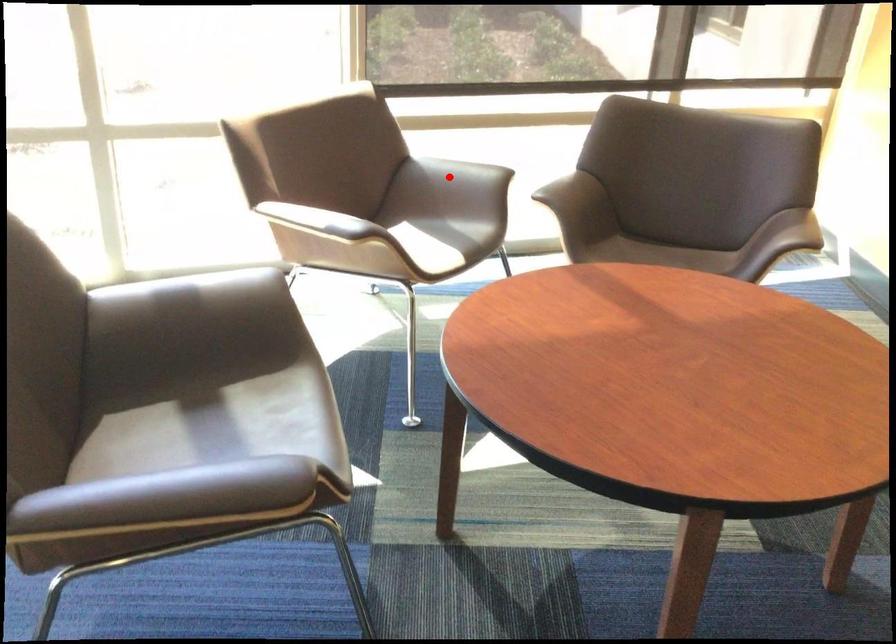
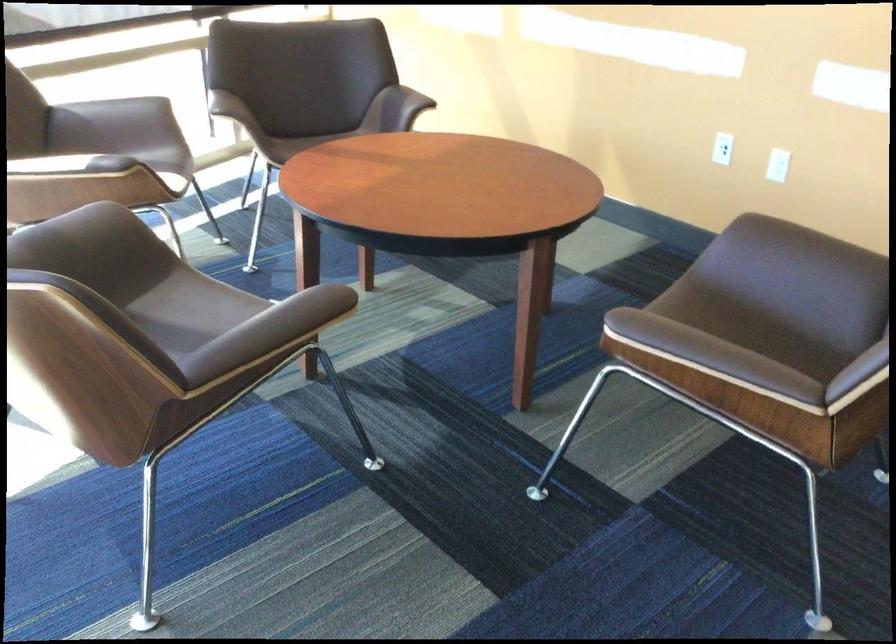
Locate, in the second image, the point that corresponds to the highlighted location in the first image.

(115, 118)